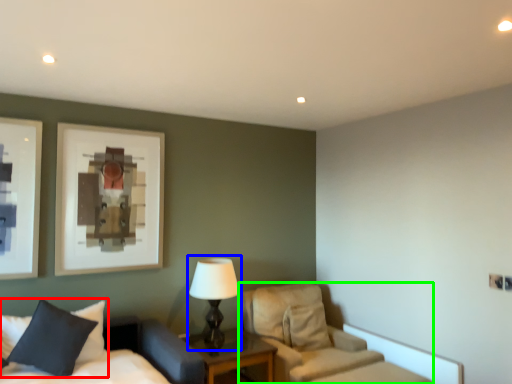
Question: Considering the real-world distances, which object is farthest from pillow (highlighted by a red box)? table lamp (highlighted by a blue box) or chair (highlighted by a green box)?

Choices:
 (A) table lamp
 (B) chair

Answer: (B)